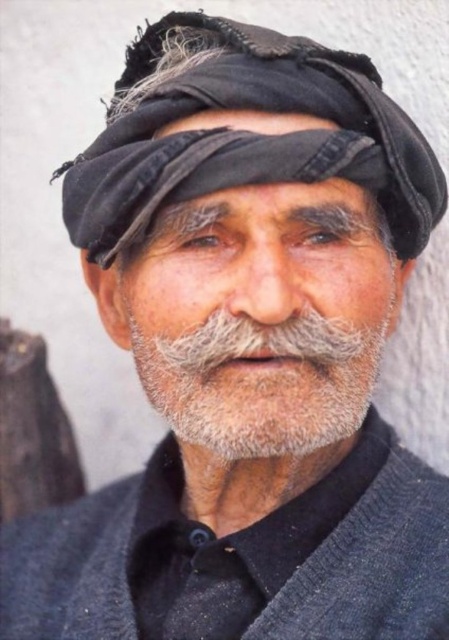
Which is more to the left, black fabric headscarf at upper center or dry skin at center?

Positioned to the left is dry skin at center.

Who is higher up, black fabric headscarf at upper center or dry skin at center?

Positioned higher is dry skin at center.

Who is more distant from viewer, (445, 202) or (273, 125)?

Positioned behind is point (445, 202).

Where is `black fabric headscarf at upper center`? black fabric headscarf at upper center is located at coordinates (243, 132).

Which is above, black fabric headscarf at upper center or gray/soft hair at center?

black fabric headscarf at upper center is above.

What do you see at coordinates (243, 132) in the screenshot? I see `black fabric headscarf at upper center` at bounding box center [243, 132].

This screenshot has width=449, height=640. What do you see at coordinates (243, 132) in the screenshot?
I see `black fabric headscarf at upper center` at bounding box center [243, 132].

Locate an element on the screen. The height and width of the screenshot is (640, 449). black fabric headscarf at upper center is located at coordinates (243, 132).

Which is behind, point (316, 371) or point (158, 132)?

The point (158, 132) is behind.

Does point (240, 412) lie in front of point (201, 124)?

Yes, it is.

Image resolution: width=449 pixels, height=640 pixels. What are the coordinates of `gray/soft hair at center` in the screenshot? It's located at (262, 380).